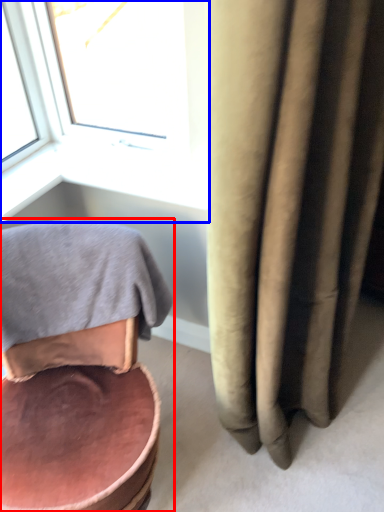
Question: Which point is closer to the camera, chair (highlighted by a red box) or window (highlighted by a blue box)?

Choices:
 (A) chair
 (B) window

Answer: (A)